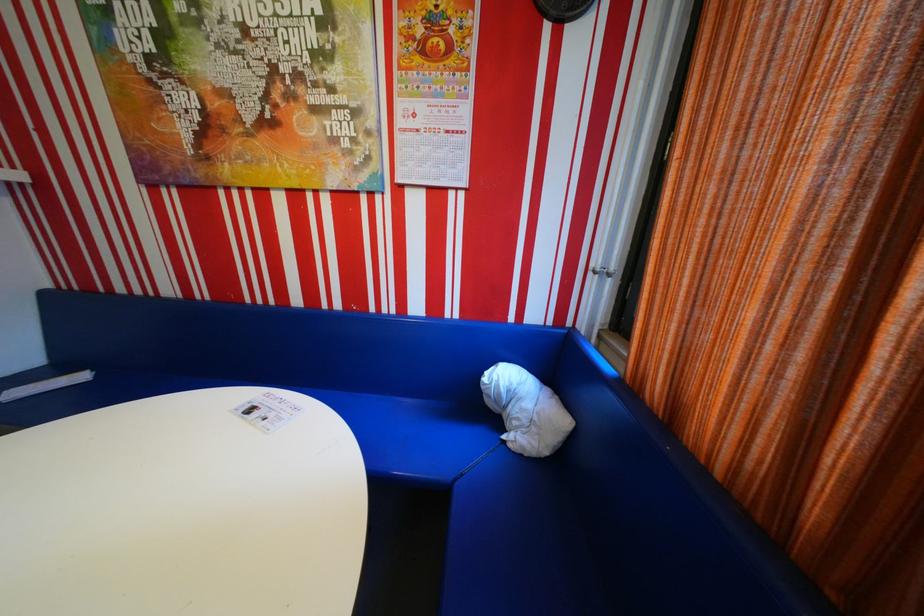
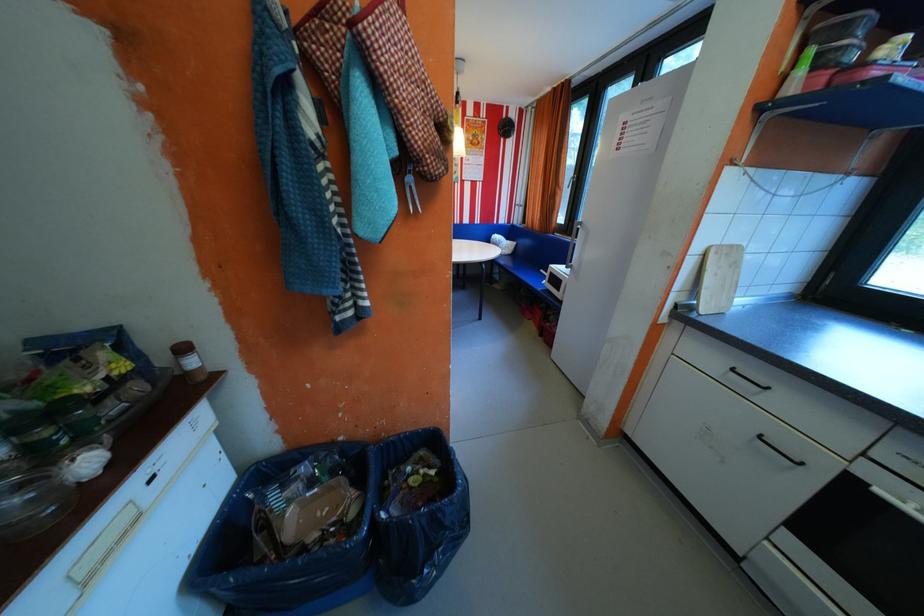
In a continuous first-person perspective shot, in which direction is the camera moving?

The movement direction of the cameraman is left, backward.